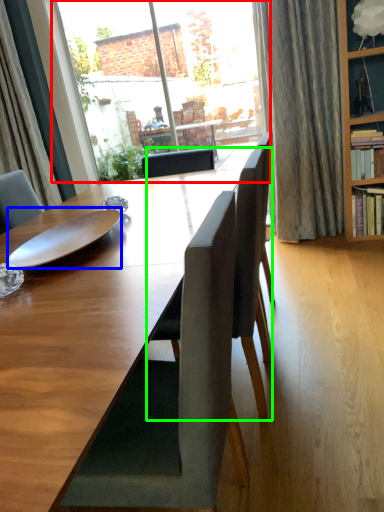
Question: Considering the real-world distances, which object is closest to window (highlighted by a red box)? plate (highlighted by a blue box) or chair (highlighted by a green box).

Choices:
 (A) plate
 (B) chair

Answer: (A)